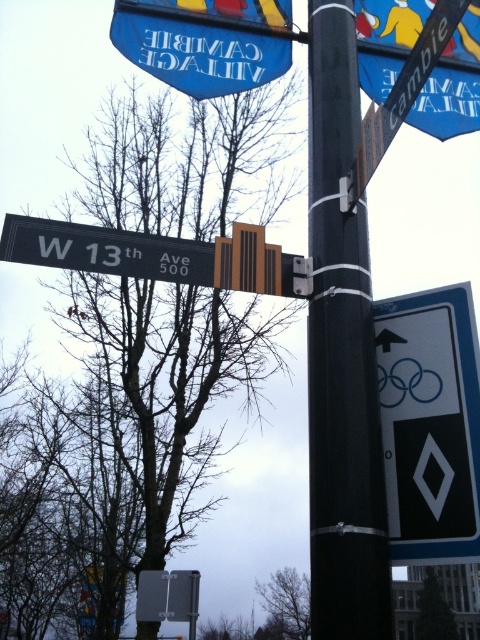
Can you confirm if blue fabric banner at upper center is thinner than metallic silver parking sign at center?

In fact, blue fabric banner at upper center might be wider than metallic silver parking sign at center.

Between point (131, 28) and point (172, 582), which one is positioned behind?

The point (172, 582) is behind.

Is point (242, 13) farther from viewer compared to point (151, 584)?

No, (242, 13) is in front of (151, 584).

Find the location of a particular element. blue fabric banner at upper center is located at coordinates (204, 42).

Looking at this image, is black plastic pole at center behind blue fabric banner at upper center?

That is False.

The height and width of the screenshot is (640, 480). Identify the location of black plastic pole at center. (342, 355).

What do you see at coordinates (342, 355) in the screenshot? I see `black plastic pole at center` at bounding box center [342, 355].

This screenshot has height=640, width=480. I want to click on black plastic pole at center, so click(342, 355).

Find the location of a particular element. The height and width of the screenshot is (640, 480). white plastic diamond at upper right is located at coordinates (430, 422).

Can you confirm if white plastic diamond at upper right is shorter than metallic silver parking sign at center?

Incorrect, white plastic diamond at upper right's height does not fall short of metallic silver parking sign at center's.

This screenshot has height=640, width=480. I want to click on white plastic diamond at upper right, so click(430, 422).

Locate an element on the screen. white plastic diamond at upper right is located at coordinates [x=430, y=422].